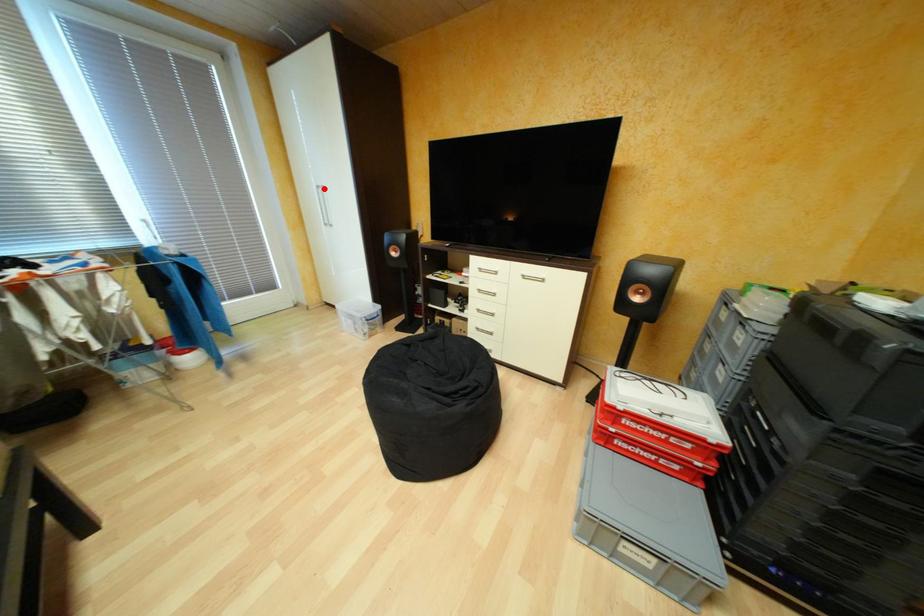
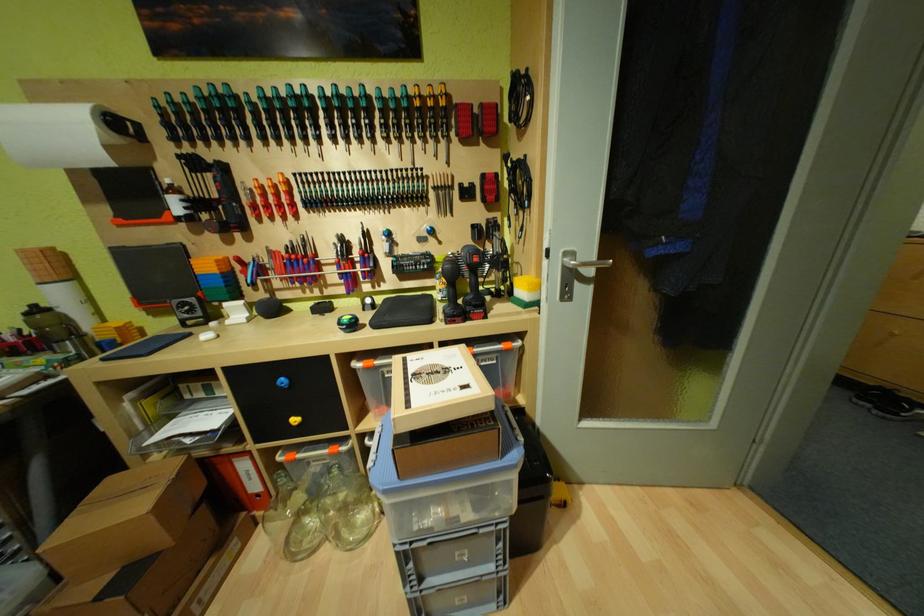
Question: I am providing you with two images of the same scene from different viewpoints. A red point is marked on the first image. Is the red point's position out of view in image 2?

Choices:
 (A) Yes
 (B) No

Answer: (A)